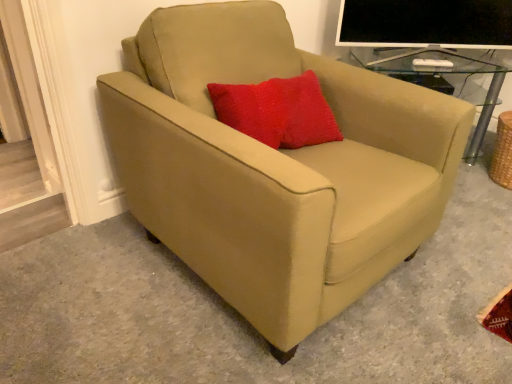
Question: In terms of size, does suede beige armchair at center appear bigger or smaller than matte black monitor at upper right?

Choices:
 (A) small
 (B) big

Answer: (B)

Question: Would you say suede beige armchair at center is to the left or to the right of matte black monitor at upper right in the picture?

Choices:
 (A) left
 (B) right

Answer: (A)

Question: From a real-world perspective, is suede beige armchair at center physically located above or below matte black monitor at upper right?

Choices:
 (A) above
 (B) below

Answer: (B)

Question: From the image's perspective, relative to suede beige armchair at center, is matte black monitor at upper right above or below?

Choices:
 (A) above
 (B) below

Answer: (A)

Question: Is matte black monitor at upper right taller or shorter than suede beige armchair at center?

Choices:
 (A) short
 (B) tall

Answer: (A)

Question: Is matte black monitor at upper right in front of or behind suede beige armchair at center in the image?

Choices:
 (A) behind
 (B) front

Answer: (A)

Question: Choose the correct answer: Is matte black monitor at upper right inside suede beige armchair at center or outside it?

Choices:
 (A) outside
 (B) inside

Answer: (A)